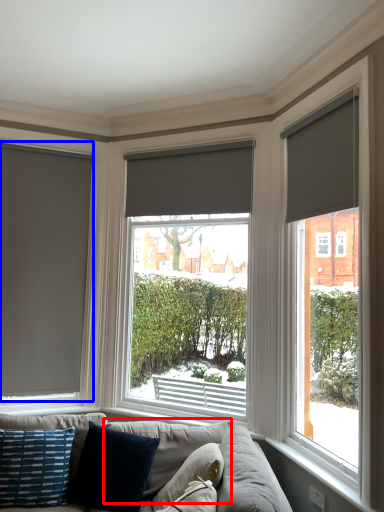
Question: Which object is further to the camera taking this photo, pillow (highlighted by a red box) or window (highlighted by a blue box)?

Choices:
 (A) pillow
 (B) window

Answer: (B)